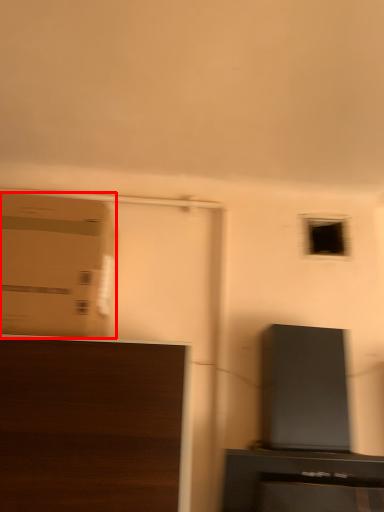
Question: Considering the relative positions of cardboard box (annotated by the red box) and furniture in the image provided, where is cardboard box (annotated by the red box) located with respect to the staircase?

Choices:
 (A) right
 (B) left

Answer: (B)